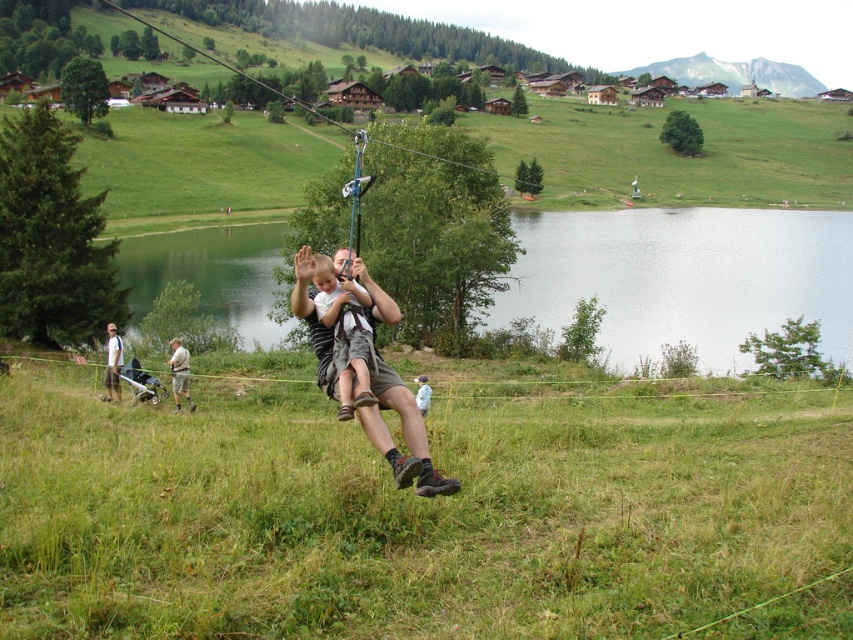
Measure the distance from light brown fabric shirt at lower left to white fabric at center.

light brown fabric shirt at lower left and white fabric at center are 7.19 meters apart.

Is light brown fabric shirt at lower left thinner than white fabric at center?

Incorrect, light brown fabric shirt at lower left's width is not less than white fabric at center's.

Find the location of `light brown fabric shirt at lower left`. light brown fabric shirt at lower left is located at coordinates (112, 364).

You are a GUI agent. You are given a task and a screenshot of the screen. Output one action in this format:
    pyautogui.click(x=<x>, y=<y>)
    Task: Click on the light brown fabric shirt at lower left
    The height and width of the screenshot is (640, 853).
    Given the screenshot: What is the action you would take?
    pyautogui.click(x=112, y=364)

Is green water at center below khaki shorts at lower left?

No, green water at center is not below khaki shorts at lower left.

Is green water at center further to the viewer compared to khaki shorts at lower left?

Yes, green water at center is behind khaki shorts at lower left.

Is point (798, 298) positioned behind point (178, 355)?

Yes.

Where is `green water at center`? This screenshot has width=853, height=640. green water at center is located at coordinates (685, 276).

Can you confirm if light brown fabric shorts at center is thinner than light brown fabric shirt at lower left?

Yes, light brown fabric shorts at center is thinner than light brown fabric shirt at lower left.

Who is more forward, (403,484) or (113,356)?

Positioned in front is point (403,484).

Is point (409, 465) closer to camera compared to point (111, 380)?

Yes, it is in front of point (111, 380).

Locate an element on the screen. The image size is (853, 640). light brown fabric shorts at center is located at coordinates (402, 435).